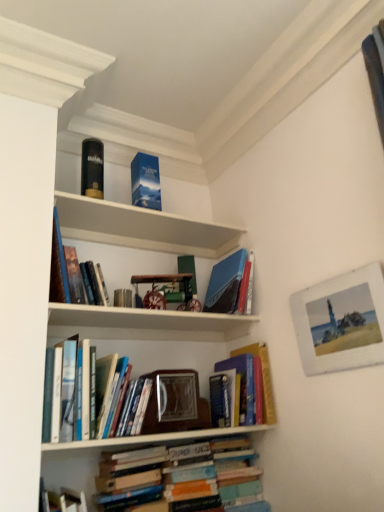
Question: Can you confirm if hardcover books at center, the third book from the bottom, is taller than blue matte book at upper center, marked as the second paperback book in a left-to-right arrangement?

Choices:
 (A) yes
 (B) no

Answer: (A)

Question: Can you confirm if hardcover books at center, the third book from the bottom, is positioned to the left of blue matte book at upper center, which is counted as the 1th paperback book, starting from the right?

Choices:
 (A) no
 (B) yes

Answer: (B)

Question: Are hardcover books at center, the third book from the bottom, and blue matte book at upper center, which is counted as the 1th paperback book, starting from the right, far apart?

Choices:
 (A) no
 (B) yes

Answer: (A)

Question: Does hardcover books at center, which is counted as the 2th book, starting from the top, come behind blue matte book at upper center, which is counted as the 1th paperback book, starting from the right?

Choices:
 (A) no
 (B) yes

Answer: (A)

Question: Considering the relative sizes of hardcover books at center, the third book from the bottom, and blue matte book at upper center, which is counted as the 1th paperback book, starting from the right, in the image provided, is hardcover books at center, the third book from the bottom, thinner than blue matte book at upper center, which is counted as the 1th paperback book, starting from the right,?

Choices:
 (A) no
 (B) yes

Answer: (A)

Question: Can you confirm if hardcover books at center, which is counted as the 2th book, starting from the top, is wider than blue matte book at upper center, marked as the second paperback book in a left-to-right arrangement?

Choices:
 (A) no
 (B) yes

Answer: (B)

Question: Are hardcover book at upper left, which is the 4th book in bottom-to-top order, and hardcover books at center, the third book from the bottom, located far from each other?

Choices:
 (A) no
 (B) yes

Answer: (A)

Question: Can you confirm if hardcover book at upper left, positioned as the first book in top-to-bottom order, is taller than hardcover books at center, which is counted as the 2th book, starting from the top?

Choices:
 (A) no
 (B) yes

Answer: (B)

Question: Is hardcover book at upper left, positioned as the first book in top-to-bottom order, at the left side of hardcover books at center, which is counted as the 2th book, starting from the top?

Choices:
 (A) yes
 (B) no

Answer: (A)

Question: Is hardcover book at upper left, which is the 4th book in bottom-to-top order, bigger than hardcover books at center, the third book from the bottom?

Choices:
 (A) no
 (B) yes

Answer: (A)

Question: Can hardcover books at center, which is counted as the 2th book, starting from the top, be found inside hardcover book at upper left, positioned as the first book in top-to-bottom order?

Choices:
 (A) yes
 (B) no

Answer: (B)

Question: Is hardcover book at upper left, which is the 4th book in bottom-to-top order, looking in the opposite direction of hardcover books at center, which is counted as the 2th book, starting from the top?

Choices:
 (A) yes
 (B) no

Answer: (B)

Question: Does hardcover books at center, the third book from the bottom, have a smaller size compared to hardcover book at center, acting as the third book starting from the top?

Choices:
 (A) yes
 (B) no

Answer: (B)